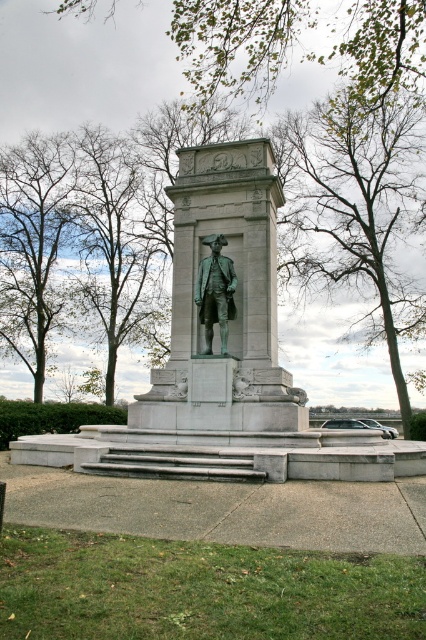
Between bare branches at upper center and bronze statue at center, which one is positioned higher?

bare branches at upper center

In the scene shown: Does bare branches at upper center have a greater width compared to bronze statue at center?

Correct, the width of bare branches at upper center exceeds that of bronze statue at center.

Does point (287, 225) come farther from viewer compared to point (213, 298)?

Yes, it is.

The height and width of the screenshot is (640, 426). I want to click on bare branches at upper center, so click(x=356, y=211).

Between green leafy branches at upper center and brown leafy tree at left, which one has less height?

Standing shorter between the two is green leafy branches at upper center.

Describe the element at coordinates (239, 42) in the screenshot. This screenshot has height=640, width=426. I see `green leafy branches at upper center` at that location.

Which is behind, point (273, 77) or point (120, 246)?

Point (120, 246)

Where is `green leafy branches at upper center`? green leafy branches at upper center is located at coordinates (239, 42).

Does green polished stone statue at center appear on the left side of green leafy branches at upper center?

Indeed, green polished stone statue at center is positioned on the left side of green leafy branches at upper center.

Between green polished stone statue at center and green leafy branches at upper center, which one has less height?

green polished stone statue at center is shorter.

The image size is (426, 640). What do you see at coordinates (230, 292) in the screenshot?
I see `green polished stone statue at center` at bounding box center [230, 292].

Where is `green polished stone statue at center`? The width and height of the screenshot is (426, 640). green polished stone statue at center is located at coordinates (230, 292).